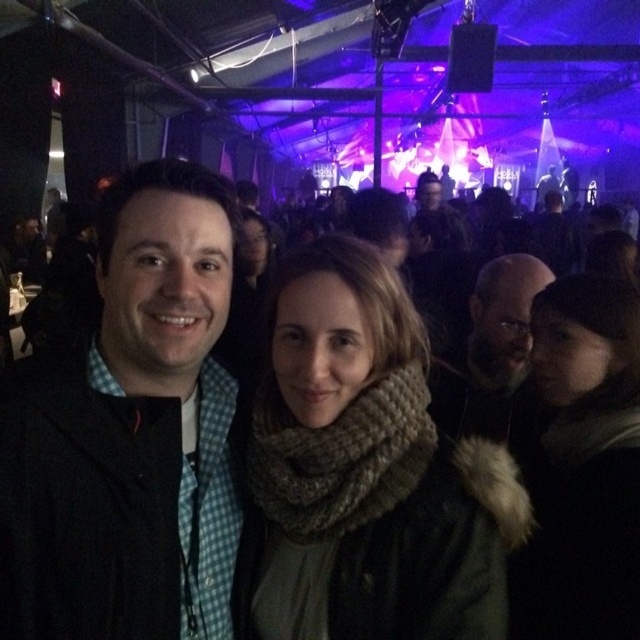
Question: Which point is farther to the camera?

Choices:
 (A) (192, 428)
 (B) (499, 275)

Answer: (B)

Question: Which object appears farthest from the camera in this image?

Choices:
 (A) black checkered shirt at center
 (B) dark brown fur coat at right
 (C) knitted beige scarf at center
 (D) knitted scarf at center

Answer: (B)

Question: Does knitted beige scarf at center have a lesser width compared to knitted scarf at center?

Choices:
 (A) no
 (B) yes

Answer: (A)

Question: Does knitted scarf at center appear on the left side of dark brown fur coat at right?

Choices:
 (A) no
 (B) yes

Answer: (A)

Question: Can you confirm if knitted beige scarf at center is positioned above knitted scarf at center?

Choices:
 (A) no
 (B) yes

Answer: (B)

Question: Which point is closer to the camera?

Choices:
 (A) (168, 554)
 (B) (490, 364)
 (C) (292, 465)
 (D) (566, 548)

Answer: (A)